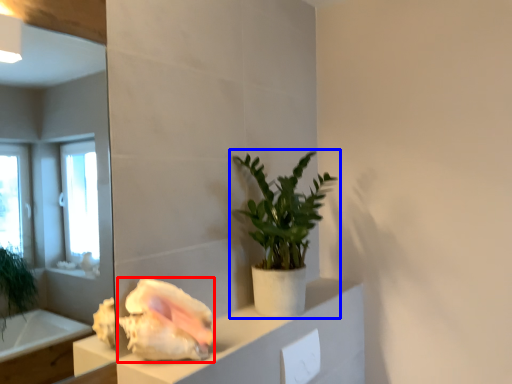
Question: Among these objects, which one is nearest to the camera, flower (highlighted by a red box) or houseplant (highlighted by a blue box)?

Choices:
 (A) flower
 (B) houseplant

Answer: (A)